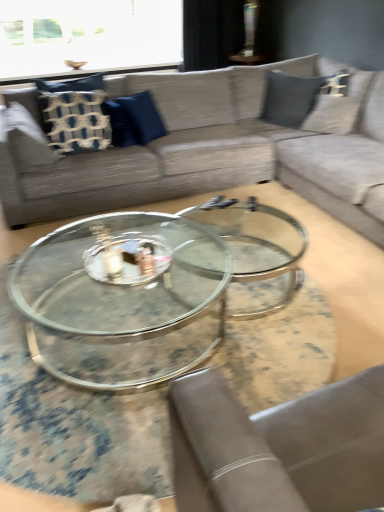
Identify the location of clear glass window screen at upper center. Image resolution: width=384 pixels, height=512 pixels. (87, 36).

Based on the photo, measure the distance between textured gray couch at upper center and camera.

textured gray couch at upper center is 2.48 meters away from camera.

Measure the distance between blue fabric pillow at center, placed as the 2th pillow when sorted from left to right, and camera.

The distance of blue fabric pillow at center, placed as the 2th pillow when sorted from left to right, from camera is 3.25 meters.

Where is `blue fabric pillow at center, which ranks as the first pillow in right-to-left order`? Image resolution: width=384 pixels, height=512 pixels. blue fabric pillow at center, which ranks as the first pillow in right-to-left order is located at coordinates (134, 120).

Find the location of a particular element. This screenshot has width=384, height=512. blue woven pillow at left, the first pillow viewed from the left is located at coordinates (74, 114).

Image resolution: width=384 pixels, height=512 pixels. I want to click on clear glass window screen at upper center, so click(x=87, y=36).

Is clear glass window screen at upper center wider or thinner than blue fabric pillow at center, which ranks as the first pillow in right-to-left order?

Clearly, clear glass window screen at upper center has more width compared to blue fabric pillow at center, which ranks as the first pillow in right-to-left order.

Which object is more forward, clear glass window screen at upper center or blue fabric pillow at center, which ranks as the first pillow in right-to-left order?

blue fabric pillow at center, which ranks as the first pillow in right-to-left order, is closer to the camera.

Is clear glass window screen at upper center inside the boundaries of blue fabric pillow at center, which ranks as the first pillow in right-to-left order, or outside?

clear glass window screen at upper center cannot be found inside blue fabric pillow at center, which ranks as the first pillow in right-to-left order.

Can you confirm if clear glass window screen at upper center is taller than blue fabric pillow at center, placed as the 2th pillow when sorted from left to right?

Yes, clear glass window screen at upper center is taller than blue fabric pillow at center, placed as the 2th pillow when sorted from left to right.

Can you confirm if black fabric curtain at upper center is bigger than blue fabric pillow at center, which ranks as the first pillow in right-to-left order?

Correct, black fabric curtain at upper center is larger in size than blue fabric pillow at center, which ranks as the first pillow in right-to-left order.

Identify the location of curtain behind the blue fabric pillow at center, placed as the 2th pillow when sorted from left to right. This screenshot has width=384, height=512. (212, 33).

From a real-world perspective, is black fabric curtain at upper center located beneath blue fabric pillow at center, which ranks as the first pillow in right-to-left order?

No.

Looking at their sizes, would you say black fabric curtain at upper center is wider or thinner than blue fabric pillow at center, placed as the 2th pillow when sorted from left to right?

black fabric curtain at upper center is wider than blue fabric pillow at center, placed as the 2th pillow when sorted from left to right.

Is blue fabric pillow at center, placed as the 2th pillow when sorted from left to right, facing away from blue woven pillow at left, the first pillow viewed from the left?

Yes, blue fabric pillow at center, placed as the 2th pillow when sorted from left to right,'s orientation is away from blue woven pillow at left, the first pillow viewed from the left.

Can you confirm if blue fabric pillow at center, placed as the 2th pillow when sorted from left to right, is smaller than blue woven pillow at left, which ranks as the 2th pillow in right-to-left order?

Yes.

Consider the image. Does blue fabric pillow at center, placed as the 2th pillow when sorted from left to right, have a lesser height compared to blue woven pillow at left, the first pillow viewed from the left?

Yes, blue fabric pillow at center, placed as the 2th pillow when sorted from left to right, is shorter than blue woven pillow at left, the first pillow viewed from the left.

Does blue fabric pillow at center, placed as the 2th pillow when sorted from left to right, appear on the left side of blue woven pillow at left, the first pillow viewed from the left?

No, blue fabric pillow at center, placed as the 2th pillow when sorted from left to right, is not to the left of blue woven pillow at left, the first pillow viewed from the left.

Which object is closer to the camera, textured gray couch at upper center or blue woven pillow at left, the first pillow viewed from the left?

textured gray couch at upper center.

Is textured gray couch at upper center not inside blue woven pillow at left, which ranks as the 2th pillow in right-to-left order?

Yes, textured gray couch at upper center is located beyond the bounds of blue woven pillow at left, which ranks as the 2th pillow in right-to-left order.

Looking at this image, is textured gray couch at upper center with blue woven pillow at left, which ranks as the 2th pillow in right-to-left order?

textured gray couch at upper center and blue woven pillow at left, which ranks as the 2th pillow in right-to-left order, are clearly separated.

Is point (24, 162) more distant than point (65, 82)?

No, (24, 162) is closer to viewer.

Considering the sizes of blue woven pillow at left, the first pillow viewed from the left, and textured gray couch at upper center in the image, is blue woven pillow at left, the first pillow viewed from the left, wider or thinner than textured gray couch at upper center?

In the image, blue woven pillow at left, the first pillow viewed from the left, appears to be more narrow than textured gray couch at upper center.

Could you measure the distance between blue woven pillow at left, which ranks as the 2th pillow in right-to-left order, and textured gray couch at upper center?

57.75 centimeters.

Which is less distant, (69, 148) or (166, 118)?

The point (69, 148) is more forward.

Is blue woven pillow at left, the first pillow viewed from the left, positioned with its back to textured gray couch at upper center?

Yes, blue woven pillow at left, the first pillow viewed from the left, is positioned with its back facing textured gray couch at upper center.

Which object is more forward, textured gray couch at upper center or blue fabric pillow at center, placed as the 2th pillow when sorted from left to right?

textured gray couch at upper center is in front.

From a real-world perspective, relative to blue fabric pillow at center, placed as the 2th pillow when sorted from left to right, is textured gray couch at upper center vertically above or below?

textured gray couch at upper center is below blue fabric pillow at center, placed as the 2th pillow when sorted from left to right.

Is point (168, 177) less distant than point (147, 123)?

That is True.

Considering the relative sizes of clear glass window screen at upper center and textured gray couch at upper center in the image provided, is clear glass window screen at upper center bigger than textured gray couch at upper center?

No.

From a real-world perspective, is clear glass window screen at upper center physically located above or below textured gray couch at upper center?

clear glass window screen at upper center is situated higher than textured gray couch at upper center in the real world.

Is clear glass window screen at upper center turned away from textured gray couch at upper center?

No, clear glass window screen at upper center is not facing away from textured gray couch at upper center.

Find the location of a particular element. The width and height of the screenshot is (384, 512). studio couch that is in front of the clear glass window screen at upper center is located at coordinates (213, 149).

From a real-world perspective, starting from the clear glass window screen at upper center, which pillow is the 2nd one below it? Please provide its 2D coordinates.

[(134, 120)]

Which pillow is the 1st one when counting from the front of the black fabric curtain at upper center? Please provide its 2D coordinates.

[(134, 120)]

From the image, which object appears to be nearer to black fabric curtain at upper center, textured gray couch at upper center or blue fabric pillow at center, placed as the 2th pillow when sorted from left to right?

blue fabric pillow at center, placed as the 2th pillow when sorted from left to right, is closer to black fabric curtain at upper center.

Based on their spatial positions, is textured gray couch at upper center or blue woven pillow at left, which ranks as the 2th pillow in right-to-left order, further from black fabric curtain at upper center?

The object further to black fabric curtain at upper center is textured gray couch at upper center.

Looking at this image, considering their positions, is blue fabric pillow at center, which ranks as the first pillow in right-to-left order, positioned closer to clear glass window screen at upper center than textured gray couch at upper center?

Based on the image, blue fabric pillow at center, which ranks as the first pillow in right-to-left order, appears to be nearer to clear glass window screen at upper center.

Estimate the real-world distances between objects in this image. Which object is closer to textured gray couch at upper center, clear glass window screen at upper center or black fabric curtain at upper center?

black fabric curtain at upper center is closer to textured gray couch at upper center.

Based on their spatial positions, is black fabric curtain at upper center or clear glass window screen at upper center closer to textured gray couch at upper center?

black fabric curtain at upper center is positioned closer to the anchor textured gray couch at upper center.

When comparing their distances from black fabric curtain at upper center, does blue woven pillow at left, which ranks as the 2th pillow in right-to-left order, or textured gray couch at upper center seem further?

textured gray couch at upper center.

When comparing their distances from textured gray couch at upper center, does blue fabric pillow at center, which ranks as the first pillow in right-to-left order, or clear glass window screen at upper center seem further?

clear glass window screen at upper center is positioned further to the anchor textured gray couch at upper center.

From the picture: Considering their positions, is clear glass window screen at upper center positioned closer to blue fabric pillow at center, placed as the 2th pillow when sorted from left to right, than black fabric curtain at upper center?

black fabric curtain at upper center is closer to blue fabric pillow at center, placed as the 2th pillow when sorted from left to right.

Where is `window screen between black fabric curtain at upper center and blue fabric pillow at center, which ranks as the first pillow in right-to-left order, in the vertical direction`? The width and height of the screenshot is (384, 512). window screen between black fabric curtain at upper center and blue fabric pillow at center, which ranks as the first pillow in right-to-left order, in the vertical direction is located at coordinates (87, 36).

Where is `window screen between blue woven pillow at left, which ranks as the 2th pillow in right-to-left order, and black fabric curtain at upper center, along the z-axis`? Image resolution: width=384 pixels, height=512 pixels. window screen between blue woven pillow at left, which ranks as the 2th pillow in right-to-left order, and black fabric curtain at upper center, along the z-axis is located at coordinates (87, 36).

The height and width of the screenshot is (512, 384). I want to click on window screen located between textured gray couch at upper center and black fabric curtain at upper center in the depth direction, so click(x=87, y=36).

Where is `pillow between clear glass window screen at upper center and blue woven pillow at left, the first pillow viewed from the left, in the vertical direction`? pillow between clear glass window screen at upper center and blue woven pillow at left, the first pillow viewed from the left, in the vertical direction is located at coordinates (134, 120).